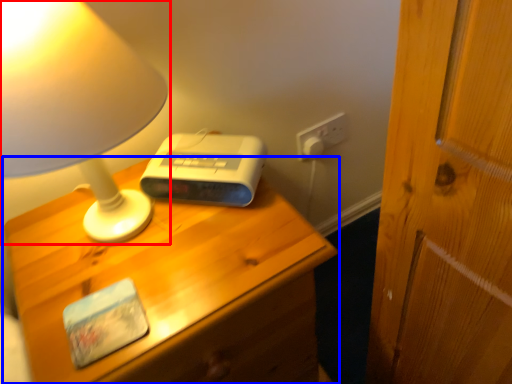
Question: Which point is closer to the camera, lamp (highlighted by a red box) or nightstand (highlighted by a blue box)?

Choices:
 (A) lamp
 (B) nightstand

Answer: (A)